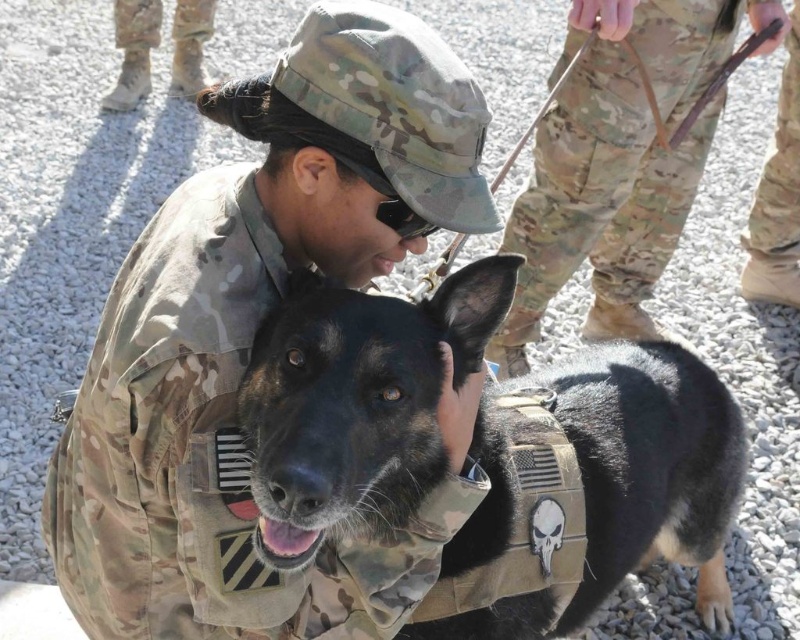
Question: Is black matte vest at center to the right of camouflage pants at center from the viewer's perspective?

Choices:
 (A) no
 (B) yes

Answer: (A)

Question: Estimate the real-world distances between objects in this image. Which object is farther from the camouflage uniform at center?

Choices:
 (A) camouflage pants at center
 (B) camouflage boots at lower left

Answer: (B)

Question: Is camouflage uniform at center positioned at the back of camouflage boots at lower left?

Choices:
 (A) no
 (B) yes

Answer: (A)

Question: Which object appears farthest from the camera in this image?

Choices:
 (A) black matte vest at center
 (B) camouflage pants at center

Answer: (B)

Question: Which is nearer to the camouflage uniform at center?

Choices:
 (A) camouflage pants at center
 (B) camouflage boots at lower left

Answer: (A)

Question: Is camouflage pants at center to the left of camouflage boots at lower left from the viewer's perspective?

Choices:
 (A) no
 (B) yes

Answer: (A)